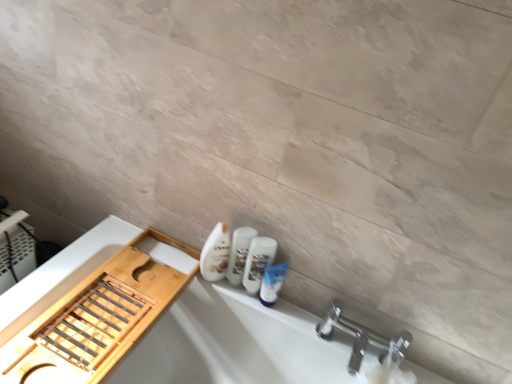
At what (x,y) coordinates should I click in order to perform the action: click on vacant position to the left of white glossy bottle at center. Please return your answer as a coordinate pair (x, y). This screenshot has width=512, height=384. Looking at the image, I should click on (152, 261).